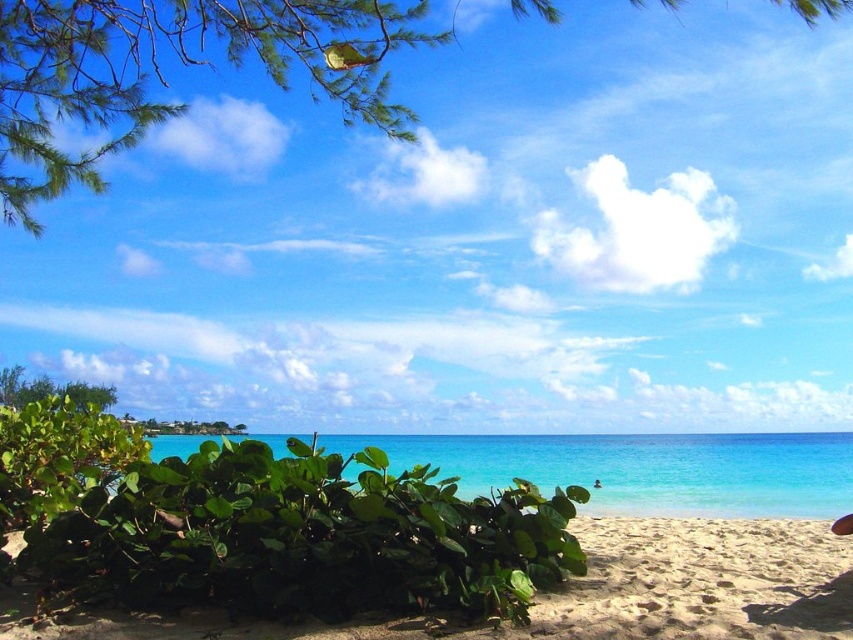
Is green leafy bush at center bigger than sandy beach at lower right?

Yes, green leafy bush at center is bigger than sandy beach at lower right.

Looking at this image, which of these two, green leafy bush at center or sandy beach at lower right, stands shorter?

sandy beach at lower right is shorter.

What do you see at coordinates (265, 524) in the screenshot? The width and height of the screenshot is (853, 640). I see `green leafy bush at center` at bounding box center [265, 524].

This screenshot has width=853, height=640. I want to click on green leafy bush at center, so click(265, 524).

Find the location of `sandy beach at lower right`. sandy beach at lower right is located at coordinates (697, 582).

Who is lower down, sandy beach at lower right or turquoise glossy water at center?

turquoise glossy water at center is lower down.

Is point (756, 522) farther from camera compared to point (744, 474)?

No, (756, 522) is closer to viewer.

This screenshot has height=640, width=853. I want to click on sandy beach at lower right, so click(x=697, y=582).

Does green leafy bush at center appear on the right side of turquoise glossy water at center?

Correct, you'll find green leafy bush at center to the right of turquoise glossy water at center.

Does point (309, 454) come farther from viewer compared to point (804, 436)?

No.

Between point (393, 477) and point (601, 492), which one is positioned behind?

The point (601, 492) is behind.

The image size is (853, 640). What are the coordinates of `green leafy bush at center` in the screenshot? It's located at (265, 524).